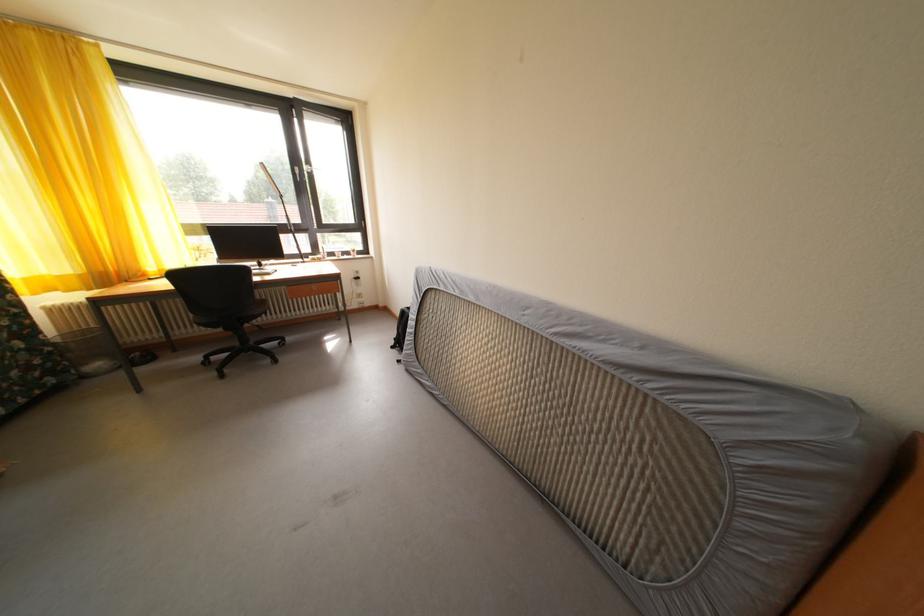
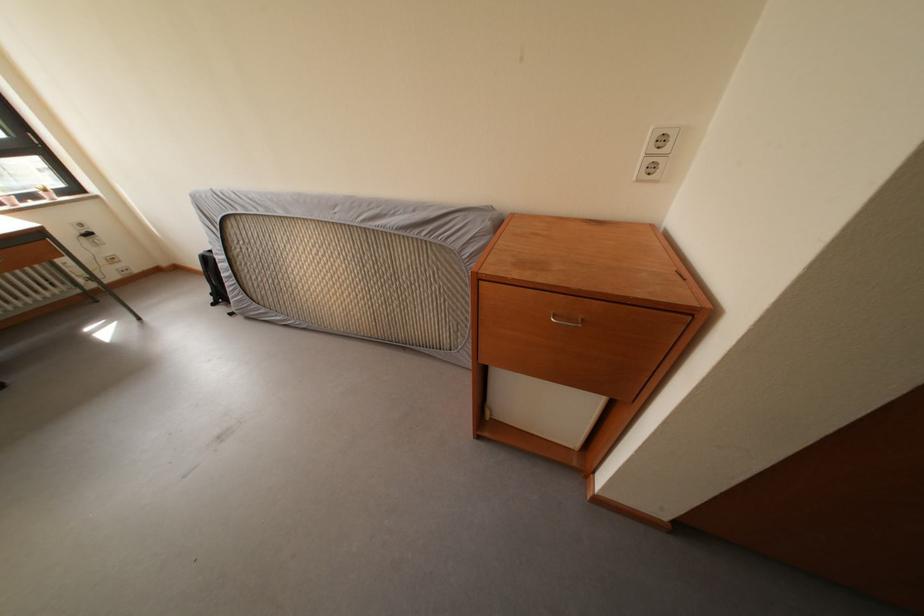
Find the pixel in the second image that matches point (370, 306) in the first image.

(128, 273)